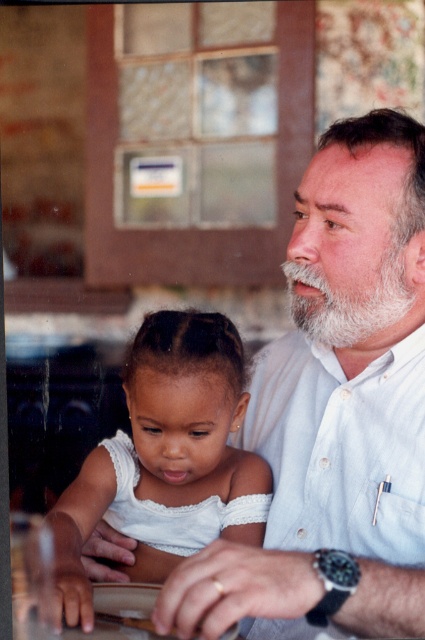
You are a photographer trying to capture a candid shot of the two subjects in the scene. You want to ensure that the white lace dress at center and the white fuzzy beard at upper right are both clearly visible in the frame. Based on their positions, which object should you focus on first to ensure both are in focus?

The white lace dress at center is to the left of white fuzzy beard at upper right, so focusing on the white lace dress at center first would ensure both are in focus since it is closer to the left side.

You are a photographer trying to capture a candid shot of the two individuals at the table. You want to ensure both the white shirt at center and the white fuzzy beard at upper right are clearly visible in the frame. Based on their sizes, which object should you focus on to ensure both are in focus?

The white shirt at center is wider than the white fuzzy beard at upper right, so focusing on the white shirt at center would ensure both are in focus as it covers a larger area.

You are a photographer who needs to focus on the white lace dress at center in the image. What are the coordinates where you should aim your camera?

The coordinates to focus on the white lace dress at center are point (167, 460).